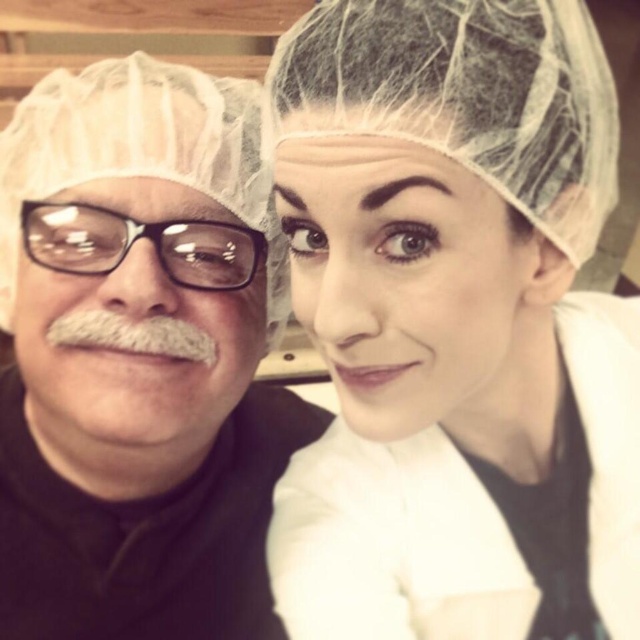
Which is in front, point (109, 237) or point (92, 323)?

Point (92, 323) is in front.

How much distance is there between transparent plastic glasses at left and white fuzzy mustache at left?

1.74 inches

Measure the distance between transparent plastic glasses at left and camera.

transparent plastic glasses at left is 19.62 inches away from camera.

Locate an element on the screen. The height and width of the screenshot is (640, 640). transparent plastic glasses at left is located at coordinates (136, 237).

Does white mesh hairnet at upper center come in front of transparent plastic glasses at left?

Yes, white mesh hairnet at upper center is closer to the viewer.

Is point (465, 417) farther from camera compared to point (45, 228)?

Yes, point (465, 417) is farther from viewer.

The height and width of the screenshot is (640, 640). Identify the location of white mesh hairnet at upper center. (456, 324).

Where is `white mesh hairnet at upper center`? The width and height of the screenshot is (640, 640). white mesh hairnet at upper center is located at coordinates (456, 324).

Can you confirm if matte black hair at left is positioned above white fuzzy mustache at left?

No.

Who is taller, matte black hair at left or white fuzzy mustache at left?

matte black hair at left

Is point (67, 193) farther from camera compared to point (120, 346)?

Yes, point (67, 193) is behind point (120, 346).

Where is `matte black hair at left`? The height and width of the screenshot is (640, 640). matte black hair at left is located at coordinates (138, 356).